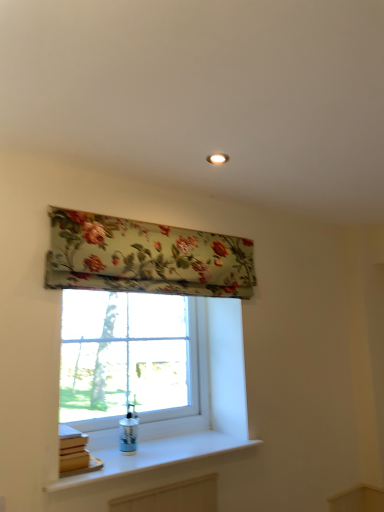
Locate an element on the screen. clear glass window at center is located at coordinates (128, 358).

Which object is thinner, white smooth window sill at lower center or clear glass window at center?

With smaller width is clear glass window at center.

Looking at the image, does white smooth window sill at lower center seem bigger or smaller compared to clear glass window at center?

Considering their sizes, white smooth window sill at lower center takes up less space than clear glass window at center.

Is clear glass window at center further to the viewer compared to floral fabric window blind at upper center?

Yes, clear glass window at center is further from the camera.

Is point (156, 401) behind point (231, 245)?

Yes, point (156, 401) is farther from viewer.

Is clear glass window at center to the right of floral fabric window blind at upper center from the viewer's perspective?

Incorrect, clear glass window at center is not on the right side of floral fabric window blind at upper center.

From the image's perspective, would you say clear glass window at center is positioned over floral fabric window blind at upper center?

No, from the image's perspective, clear glass window at center is not on top of floral fabric window blind at upper center.

Based on the photo, considering the relative sizes of floral fabric window blind at upper center and white smooth window sill at lower center in the image provided, is floral fabric window blind at upper center smaller than white smooth window sill at lower center?

Incorrect, floral fabric window blind at upper center is not smaller in size than white smooth window sill at lower center.

Considering the sizes of floral fabric window blind at upper center and white smooth window sill at lower center in the image, is floral fabric window blind at upper center wider or thinner than white smooth window sill at lower center?

Considering their sizes, floral fabric window blind at upper center looks slimmer than white smooth window sill at lower center.

Is floral fabric window blind at upper center facing towards white smooth window sill at lower center?

No.

Considering the positions of objects floral fabric window blind at upper center and white smooth window sill at lower center in the image provided, who is in front, floral fabric window blind at upper center or white smooth window sill at lower center?

white smooth window sill at lower center is in front.

Considering the sizes of objects white smooth window sill at lower center and floral fabric window blind at upper center in the image provided, who is thinner, white smooth window sill at lower center or floral fabric window blind at upper center?

floral fabric window blind at upper center.

Considering the relative sizes of white smooth window sill at lower center and floral fabric window blind at upper center in the image provided, is white smooth window sill at lower center smaller than floral fabric window blind at upper center?

Indeed, white smooth window sill at lower center has a smaller size compared to floral fabric window blind at upper center.

In the scene shown: From the image's perspective, relative to floral fabric window blind at upper center, is white smooth window sill at lower center above or below?

From the image's perspective, white smooth window sill at lower center appears below floral fabric window blind at upper center.

What's the angular difference between white smooth window sill at lower center and floral fabric window blind at upper center's facing directions?

1.38 degrees separate the facing orientations of white smooth window sill at lower center and floral fabric window blind at upper center.

Is clear glass window at center facing towards white smooth window sill at lower center?

Yes, clear glass window at center faces towards white smooth window sill at lower center.

Is point (99, 301) closer or farther from the camera than point (189, 447)?

Point (99, 301) appears to be farther away from the viewer than point (189, 447).

Which object is wider, clear glass window at center or white smooth window sill at lower center?

white smooth window sill at lower center is wider.

Does clear glass window at center have a smaller size compared to white smooth window sill at lower center?

Incorrect, clear glass window at center is not smaller in size than white smooth window sill at lower center.

Is floral fabric window blind at upper center smaller than clear glass window at center?

Indeed, floral fabric window blind at upper center has a smaller size compared to clear glass window at center.

Which object is more forward, floral fabric window blind at upper center or clear glass window at center?

Positioned in front is floral fabric window blind at upper center.

Looking at their sizes, would you say floral fabric window blind at upper center is wider or thinner than clear glass window at center?

Clearly, floral fabric window blind at upper center has less width compared to clear glass window at center.

Locate an element on the screen. This screenshot has height=512, width=384. window positioned vertically above the white smooth window sill at lower center (from a real-world perspective) is located at coordinates (128, 358).

The image size is (384, 512). Find the location of `window that appears below the floral fabric window blind at upper center (from a real-world perspective)`. window that appears below the floral fabric window blind at upper center (from a real-world perspective) is located at coordinates (128, 358).

Estimate the real-world distances between objects in this image. Which object is further from white smooth window sill at lower center, clear glass window at center or floral fabric window blind at upper center?

The object further to white smooth window sill at lower center is floral fabric window blind at upper center.

From the image, which object appears to be farther from floral fabric window blind at upper center, white smooth window sill at lower center or clear glass window at center?

Among the two, white smooth window sill at lower center is located further to floral fabric window blind at upper center.

From the image, which object appears to be farther from floral fabric window blind at upper center, clear glass window at center or white smooth window sill at lower center?

Answer: white smooth window sill at lower center.

Looking at the image, which one is located further to clear glass window at center, floral fabric window blind at upper center or white smooth window sill at lower center?

Among the two, floral fabric window blind at upper center is located further to clear glass window at center.

Which object lies further to the anchor point white smooth window sill at lower center, floral fabric window blind at upper center or clear glass window at center?

floral fabric window blind at upper center lies further to white smooth window sill at lower center than the other object.

Which object lies nearer to the anchor point clear glass window at center, white smooth window sill at lower center or floral fabric window blind at upper center?

Based on the image, white smooth window sill at lower center appears to be nearer to clear glass window at center.

Where is `window between floral fabric window blind at upper center and white smooth window sill at lower center in the vertical direction`? The height and width of the screenshot is (512, 384). window between floral fabric window blind at upper center and white smooth window sill at lower center in the vertical direction is located at coordinates (128, 358).